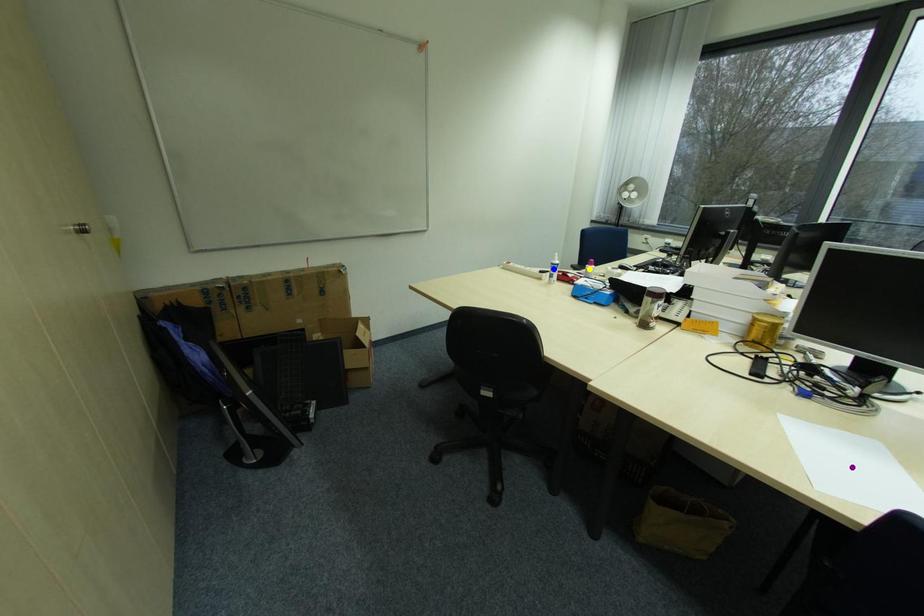
Order these from nearest to farthest:
purple point
blue point
yellow point

1. purple point
2. yellow point
3. blue point